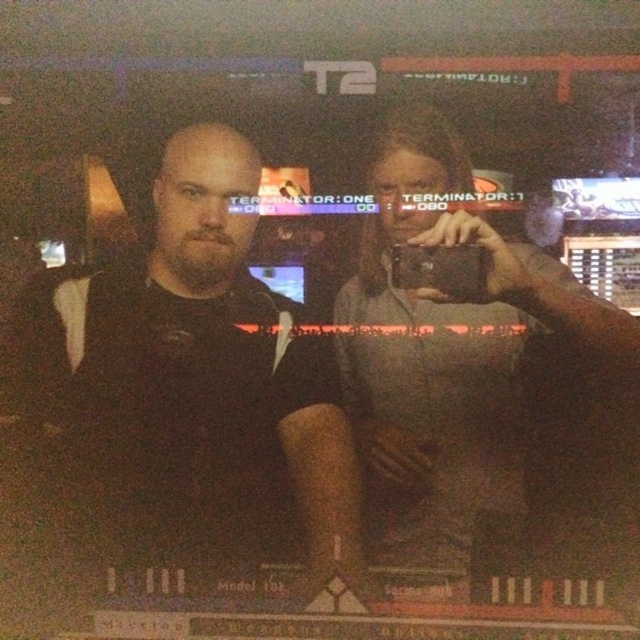
You are standing in the gaming venue and need to take a photo of the black matte shirt at center and the black matte camera at center. Which object should you focus on first if you want to capture both in a single frame without moving the camera?

You should focus on the black matte shirt at center first because it is taller than the black matte camera at center, ensuring it fits within the frame when capturing both.

You are at an arcade and want to take a photo of the gray fabric shirt at upper center without the black matte shirt at center blocking it. How should you position yourself?

The gray fabric shirt at upper center is behind the black matte shirt at center, so you should move to a position where you can see behind the black matte shirt at center to capture the gray fabric shirt at upper center without obstruction.